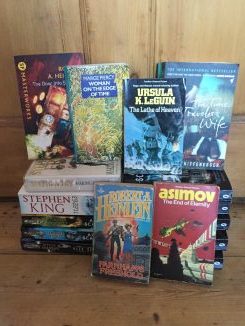
Locate an element on the screen. top books is located at coordinates (204, 101), (158, 116), (108, 124), (54, 110).